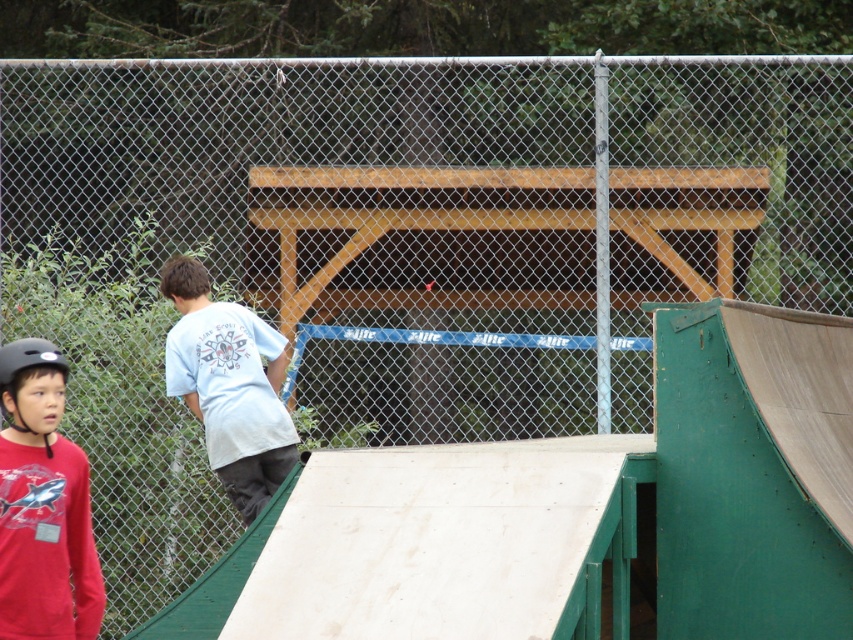
Can you confirm if white cotton shirt at center is positioned above matte black helmet at left?

No, white cotton shirt at center is not above matte black helmet at left.

Does white cotton shirt at center have a larger size compared to matte black helmet at left?

Indeed, white cotton shirt at center has a larger size compared to matte black helmet at left.

Between point (260, 492) and point (0, 356), which one is positioned behind?

The point (260, 492) is more distant.

Locate an element on the screen. This screenshot has width=853, height=640. white cotton shirt at center is located at coordinates (229, 385).

Does red matte shirt at left have a lesser width compared to matte black helmet at left?

No.

What do you see at coordinates (44, 506) in the screenshot? I see `red matte shirt at left` at bounding box center [44, 506].

This screenshot has height=640, width=853. I want to click on red matte shirt at left, so click(44, 506).

Is red matte shirt at left below white cotton shirt at center?

Yes.

From the picture: Is red matte shirt at left thinner than white cotton shirt at center?

Yes, red matte shirt at left is thinner than white cotton shirt at center.

Measure the distance between point (45,611) and camera.

A distance of 6.29 meters exists between point (45,611) and camera.

Find the location of `red matte shirt at left`. red matte shirt at left is located at coordinates (44, 506).